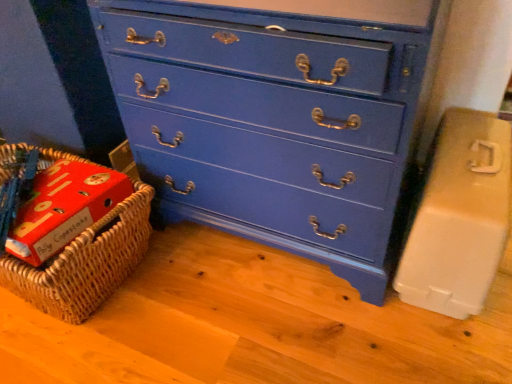
Question: From a real-world perspective, is woven brown basket at lower left on top of blue painted wood chest of drawers at center?

Choices:
 (A) yes
 (B) no

Answer: (B)

Question: Is woven brown basket at lower left at the right side of blue painted wood chest of drawers at center?

Choices:
 (A) no
 (B) yes

Answer: (A)

Question: Considering the relative sizes of woven brown basket at lower left and blue painted wood chest of drawers at center in the image provided, is woven brown basket at lower left wider than blue painted wood chest of drawers at center?

Choices:
 (A) no
 (B) yes

Answer: (A)

Question: From the image's perspective, is woven brown basket at lower left beneath blue painted wood chest of drawers at center?

Choices:
 (A) no
 (B) yes

Answer: (B)

Question: From the image's perspective, is woven brown basket at lower left above blue painted wood chest of drawers at center?

Choices:
 (A) yes
 (B) no

Answer: (B)

Question: Is woven brown basket at lower left closer to the viewer compared to blue painted wood chest of drawers at center?

Choices:
 (A) no
 (B) yes

Answer: (A)

Question: Considering the relative sizes of woven brown basket at lower left and beige plastic container at right in the image provided, is woven brown basket at lower left thinner than beige plastic container at right?

Choices:
 (A) no
 (B) yes

Answer: (B)

Question: Is woven brown basket at lower left directly adjacent to beige plastic container at right?

Choices:
 (A) yes
 (B) no

Answer: (B)

Question: Could you tell me if woven brown basket at lower left is turned towards beige plastic container at right?

Choices:
 (A) no
 (B) yes

Answer: (A)

Question: Is woven brown basket at lower left outside beige plastic container at right?

Choices:
 (A) yes
 (B) no

Answer: (A)

Question: Is woven brown basket at lower left not near beige plastic container at right?

Choices:
 (A) yes
 (B) no

Answer: (B)

Question: From the image's perspective, is woven brown basket at lower left under beige plastic container at right?

Choices:
 (A) no
 (B) yes

Answer: (B)

Question: Is beige plastic container at right facing away from woven brown basket at lower left?

Choices:
 (A) yes
 (B) no

Answer: (B)